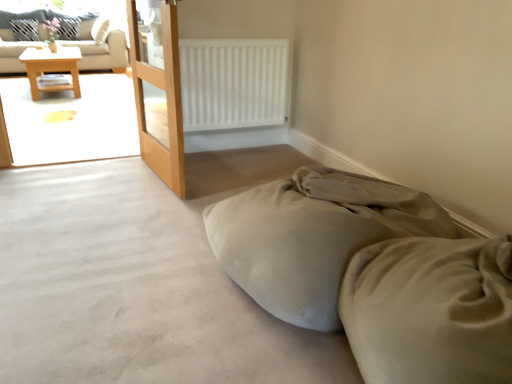
Question: Could you tell me if beige fabric couch at upper left is facing white fabric pillow at upper left, which is the second pillow in right-to-left order?

Choices:
 (A) no
 (B) yes

Answer: (B)

Question: Does beige fabric couch at upper left lie in front of white fabric pillow at upper left, which is counted as the first pillow, starting from the left?

Choices:
 (A) no
 (B) yes

Answer: (B)

Question: Is beige fabric couch at upper left not close to white fabric pillow at upper left, which is the second pillow in right-to-left order?

Choices:
 (A) yes
 (B) no

Answer: (B)

Question: Considering the relative positions of beige fabric couch at upper left and white fabric pillow at upper left, which is the second pillow in right-to-left order, in the image provided, is beige fabric couch at upper left to the left of white fabric pillow at upper left, which is the second pillow in right-to-left order, from the viewer's perspective?

Choices:
 (A) yes
 (B) no

Answer: (B)

Question: Considering the relative positions of beige fabric couch at upper left and white fabric pillow at upper left, which is counted as the first pillow, starting from the left, in the image provided, is beige fabric couch at upper left to the right of white fabric pillow at upper left, which is counted as the first pillow, starting from the left, from the viewer's perspective?

Choices:
 (A) yes
 (B) no

Answer: (A)

Question: From the image's perspective, relative to white fabric pillow at upper left, which appears as the second pillow when viewed from the left, is wooden table at left above or below?

Choices:
 (A) below
 (B) above

Answer: (A)

Question: Is point (72, 82) positioned closer to the camera than point (69, 23)?

Choices:
 (A) closer
 (B) farther

Answer: (A)

Question: Would you say wooden table at left is inside or outside white fabric pillow at upper left, which appears as the second pillow when viewed from the left?

Choices:
 (A) inside
 (B) outside

Answer: (B)

Question: From a real-world perspective, is wooden table at left above or below white fabric pillow at upper left, which appears as the second pillow when viewed from the left?

Choices:
 (A) below
 (B) above

Answer: (A)

Question: Considering the positions of suede-like beige bed at lower right and white matte radiator at upper center in the image, is suede-like beige bed at lower right taller or shorter than white matte radiator at upper center?

Choices:
 (A) tall
 (B) short

Answer: (B)

Question: Is suede-like beige bed at lower right spatially inside white matte radiator at upper center, or outside of it?

Choices:
 (A) inside
 (B) outside

Answer: (B)

Question: From a real-world perspective, relative to white matte radiator at upper center, is suede-like beige bed at lower right vertically above or below?

Choices:
 (A) below
 (B) above

Answer: (A)

Question: Considering the positions of suede-like beige bed at lower right and white matte radiator at upper center in the image, is suede-like beige bed at lower right wider or thinner than white matte radiator at upper center?

Choices:
 (A) wide
 (B) thin

Answer: (A)

Question: Considering the positions of point (12, 59) and point (237, 94), is point (12, 59) closer or farther from the camera than point (237, 94)?

Choices:
 (A) closer
 (B) farther

Answer: (B)

Question: Would you say beige fabric couch at upper left is to the left or to the right of white matte radiator at upper center in the picture?

Choices:
 (A) right
 (B) left

Answer: (B)